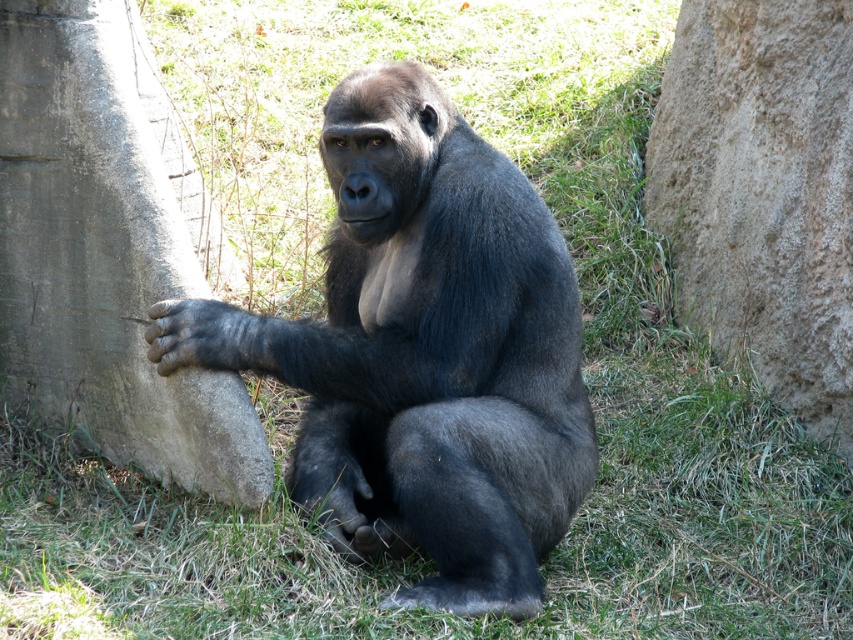
Between gray concrete tree trunk at left and black matte mouth at center, which one is positioned higher?

black matte mouth at center is above.

Measure the distance between gray concrete tree trunk at left and camera.

gray concrete tree trunk at left is 11.52 feet from camera.

Between point (102, 134) and point (372, 186), which one is positioned in front?

Positioned in front is point (372, 186).

This screenshot has width=853, height=640. What are the coordinates of `gray concrete tree trunk at left` in the screenshot? It's located at (108, 250).

I want to click on shiny black gorilla at center, so click(x=438, y=356).

I want to click on shiny black gorilla at center, so click(x=438, y=356).

Does shiny black gorilla at center have a greater width compared to gray concrete tree trunk at left?

Yes, shiny black gorilla at center is wider than gray concrete tree trunk at left.

Who is more forward, (498, 563) or (41, 163)?

Point (498, 563) is in front.

Measure the distance between point (337, 403) and camera.

Point (337, 403) and camera are 3.62 meters apart.

Image resolution: width=853 pixels, height=640 pixels. I want to click on shiny black gorilla at center, so click(438, 356).